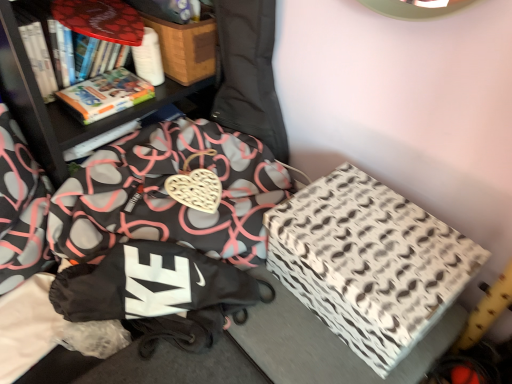
Question: Should I look upward or downward to see wooden box at upper center, the first cardboard box when ordered from top to bottom?

Choices:
 (A) up
 (B) down

Answer: (A)

Question: Is wooden box at upper center, which appears as the 1th cardboard box when viewed from the left, not close to black fabric bean bag chair at center?

Choices:
 (A) yes
 (B) no

Answer: (B)

Question: Does wooden box at upper center, which appears as the 1th cardboard box when viewed from the left, appear on the right side of black fabric bean bag chair at center?

Choices:
 (A) no
 (B) yes

Answer: (A)

Question: Is wooden box at upper center, the first cardboard box when ordered from top to bottom, oriented away from black fabric bean bag chair at center?

Choices:
 (A) no
 (B) yes

Answer: (A)

Question: From a real-world perspective, is wooden box at upper center, positioned as the 2th cardboard box in bottom-to-top order, over black fabric bean bag chair at center?

Choices:
 (A) no
 (B) yes

Answer: (A)

Question: From the image's perspective, is wooden box at upper center, the first cardboard box when ordered from top to bottom, located above black fabric bean bag chair at center?

Choices:
 (A) yes
 (B) no

Answer: (A)

Question: Considering the relative sizes of wooden box at upper center, which appears as the 1th cardboard box when viewed from the left, and black fabric bean bag chair at center in the image provided, is wooden box at upper center, which appears as the 1th cardboard box when viewed from the left, taller than black fabric bean bag chair at center?

Choices:
 (A) yes
 (B) no

Answer: (B)

Question: From a real-world perspective, does wooden box at upper center, the second cardboard box in the right-to-left sequence, sit lower than hardcover book at upper left?

Choices:
 (A) yes
 (B) no

Answer: (B)

Question: Is wooden box at upper center, which appears as the 1th cardboard box when viewed from the left, at the right side of hardcover book at upper left?

Choices:
 (A) yes
 (B) no

Answer: (A)

Question: Can you confirm if wooden box at upper center, the first cardboard box when ordered from top to bottom, is smaller than hardcover book at upper left?

Choices:
 (A) yes
 (B) no

Answer: (B)

Question: Does wooden box at upper center, positioned as the 2th cardboard box in bottom-to-top order, appear on the left side of hardcover book at upper left?

Choices:
 (A) yes
 (B) no

Answer: (B)

Question: Is wooden box at upper center, positioned as the 2th cardboard box in bottom-to-top order, shorter than hardcover book at upper left?

Choices:
 (A) yes
 (B) no

Answer: (B)

Question: Is wooden box at upper center, the second cardboard box in the right-to-left sequence, taller than hardcover book at upper left?

Choices:
 (A) yes
 (B) no

Answer: (A)

Question: Is black fabric bag at lower left wider than hardcover book at upper left?

Choices:
 (A) yes
 (B) no

Answer: (A)